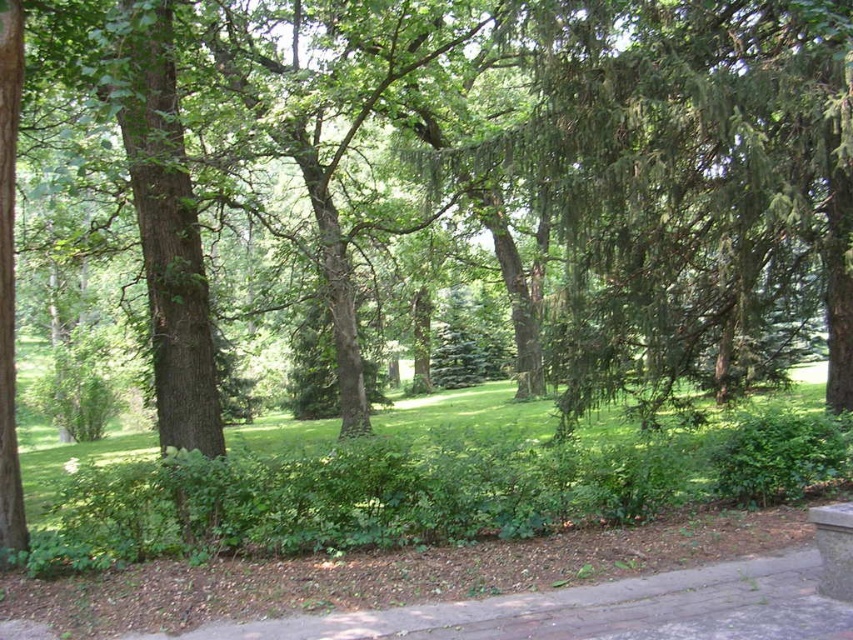
You are a gardener with a 3 meter long hose. You need to water the green leafy grass at center from the brown brick pavement at lower center. Can your hose reach the grass?

The green leafy grass at center and brown brick pavement at lower center are 2.99 meters apart from each other. Since the hose is 3 meters long, it can reach the grass.

You are a gardener who needs to water the green leafy grass at center and the brown brick pavement at lower center. Since the pavement is behind the grass, which area should you water first to avoid the water from the pavement splashing onto the grass?

You should water the green leafy grass at center first before the brown brick pavement at lower center. Since the brown brick pavement is behind the grass, watering the grass first will prevent water from the pavement splashing onto it later.